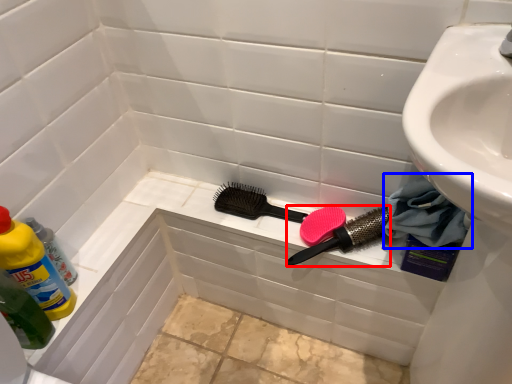
Question: Among these objects, which one is nearest to the camera, brush (highlighted by a red box) or material (highlighted by a blue box)?

Choices:
 (A) brush
 (B) material

Answer: (B)